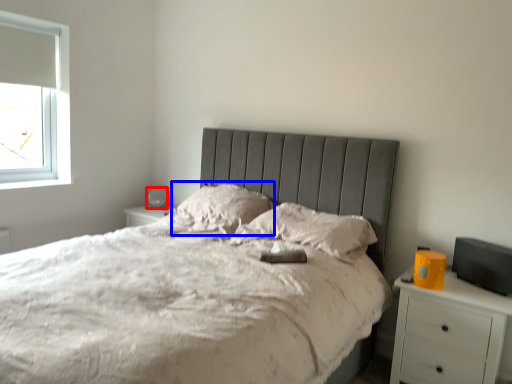
Question: Which object appears closest to the camera in this image, table lamp (highlighted by a red box) or pillow (highlighted by a blue box)?

Choices:
 (A) table lamp
 (B) pillow

Answer: (B)